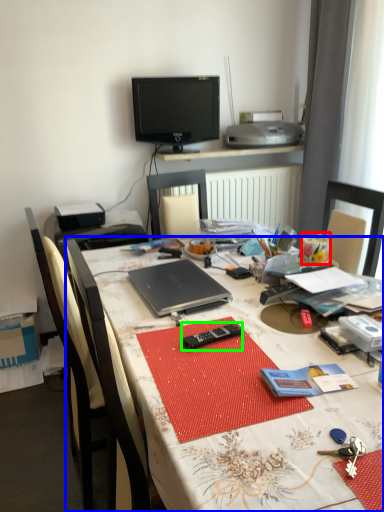
Question: Estimate the real-world distances between objects in this image. Which object is farther from stationery (highlighted by a red box), desk (highlighted by a blue box) or remote (highlighted by a green box)?

Choices:
 (A) desk
 (B) remote

Answer: (A)